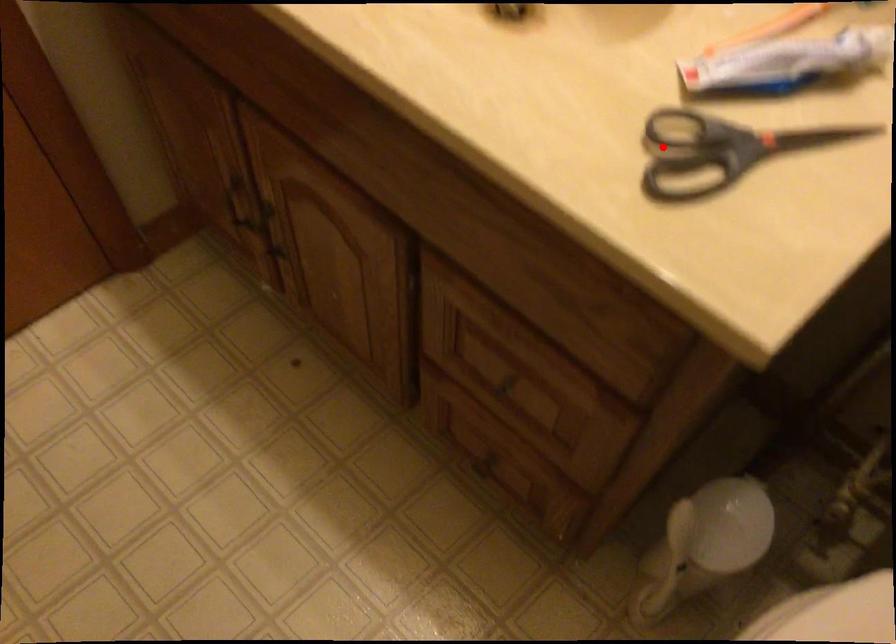
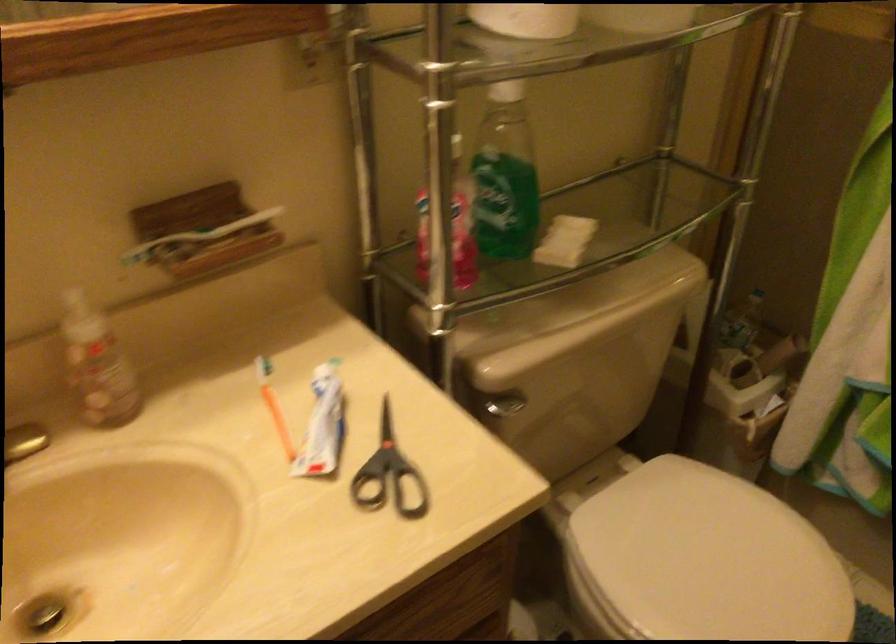
Question: I am providing you with two images of the same scene from different viewpoints. In image1, a red point is highlighted. Considering the same 3D point in image2, which of the following is correct?

Choices:
 (A) It is closer
 (B) It is farther

Answer: (B)